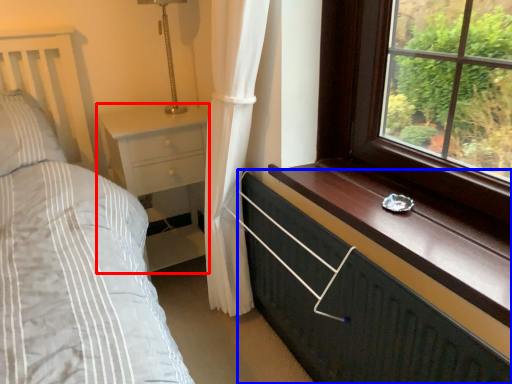
Question: Among these objects, which one is farthest to the camera, nightstand (highlighted by a red box) or chest of drawers (highlighted by a blue box)?

Choices:
 (A) nightstand
 (B) chest of drawers

Answer: (A)